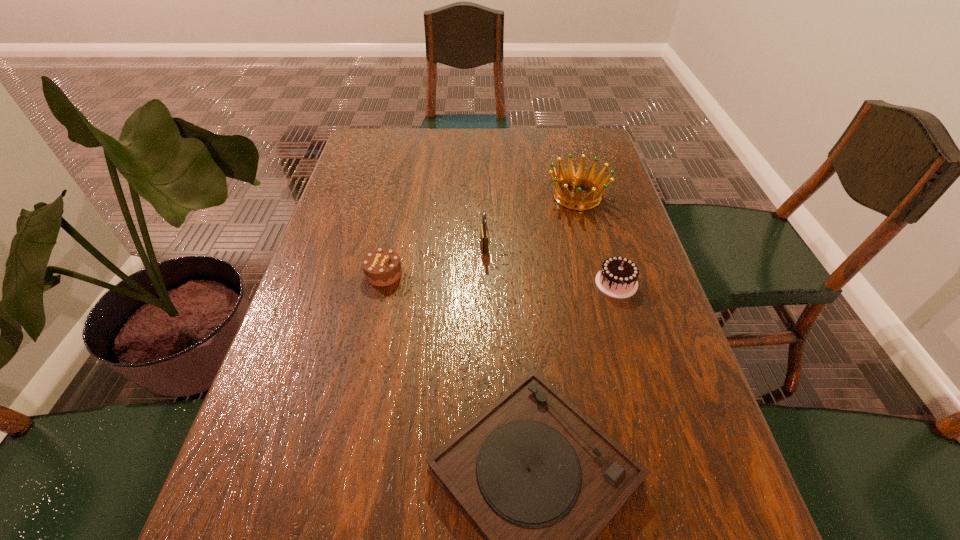
Image resolution: width=960 pixels, height=540 pixels. In order to click on the second farthest object in this screenshot , I will do `click(484, 233)`.

At what (x,y) coordinates should I click in order to perform the action: click on padlock. Please return your answer as a coordinate pair (x, y). The image size is (960, 540). Looking at the image, I should click on (484, 233).

Locate an element on the screen. This screenshot has height=540, width=960. crown is located at coordinates (564, 180).

Locate an element on the screen. The height and width of the screenshot is (540, 960). the right chocolate cake is located at coordinates (618, 276).

In order to click on the fourth tallest object in this screenshot , I will do `click(382, 267)`.

What are the coordinates of `the shorter chocolate cake` in the screenshot? It's located at [382, 267].

Locate an element on the screen. free space located 0.230m on the back of the padlock is located at coordinates (484, 188).

This screenshot has height=540, width=960. I want to click on free space located 0.150m on the back of the crown, so click(x=566, y=154).

Identify the location of vacant space located 0.240m on the left of the right chocolate cake. The image size is (960, 540). (494, 283).

Where is `vacant position located on the back of the shorter chocolate cake`? The image size is (960, 540). vacant position located on the back of the shorter chocolate cake is located at coordinates (392, 237).